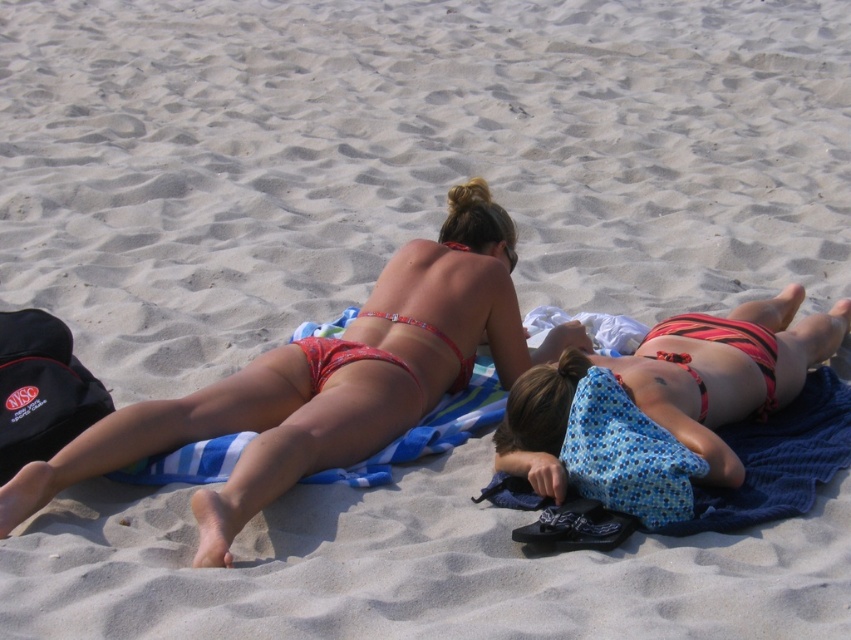
Question: Is matte red bikini at upper center below striped bikini at center?

Choices:
 (A) yes
 (B) no

Answer: (A)

Question: Which point appears farthest from the camera in this image?

Choices:
 (A) (153, 428)
 (B) (752, 333)

Answer: (B)

Question: Estimate the real-world distances between objects in this image. Which object is closer to the red matte bikini top at center?

Choices:
 (A) matte red bikini at upper center
 (B) striped bikini at center

Answer: (B)

Question: Is striped bikini at center wider than red matte bikini top at center?

Choices:
 (A) no
 (B) yes

Answer: (B)

Question: Estimate the real-world distances between objects in this image. Which object is closer to the red matte bikini top at center?

Choices:
 (A) striped bikini at center
 (B) matte red bikini at upper center

Answer: (A)

Question: From the image, what is the correct spatial relationship of matte red bikini at upper center in relation to striped bikini at center?

Choices:
 (A) left
 (B) right

Answer: (A)